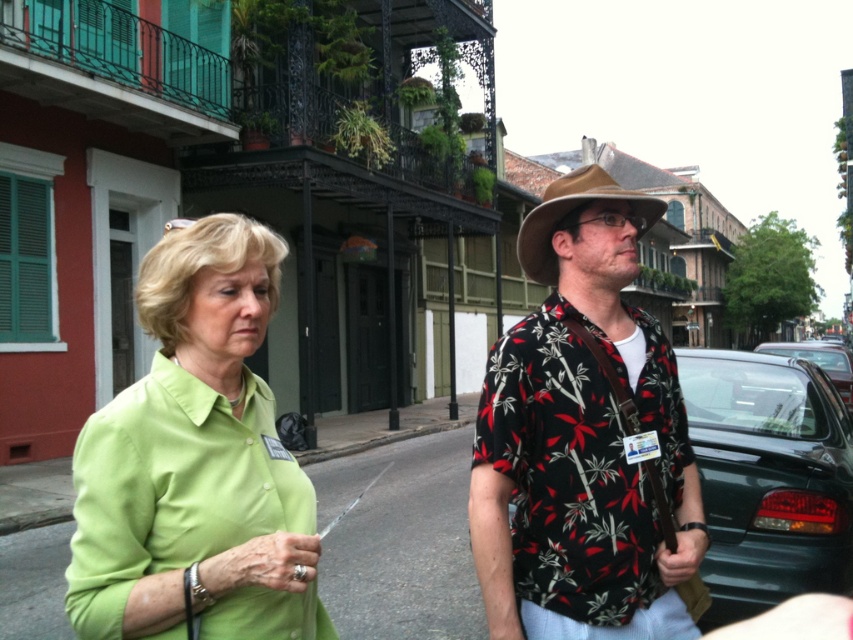
Question: Observing the image, what is the correct spatial positioning of floral-patterned shirt at center in reference to green smooth shirt at center?

Choices:
 (A) above
 (B) below

Answer: (A)

Question: Which point is closer to the camera?

Choices:
 (A) green matte shirt at left
 (B) metallic silver car at right
 (C) floral-patterned shirt at center

Answer: (A)

Question: From the image, what is the correct spatial relationship of brown felt fedora at center in relation to metallic silver car at right?

Choices:
 (A) right
 (B) left

Answer: (B)

Question: From the image, what is the correct spatial relationship of green matte shirt at left in relation to brown felt fedora at center?

Choices:
 (A) left
 (B) right

Answer: (A)

Question: Which object appears farthest from the camera in this image?

Choices:
 (A) green smooth shirt at center
 (B) metallic silver car at right
 (C) floral-patterned shirt at center

Answer: (B)

Question: Which of the following is the farthest from the observer?

Choices:
 (A) (164, 282)
 (B) (761, 342)

Answer: (B)